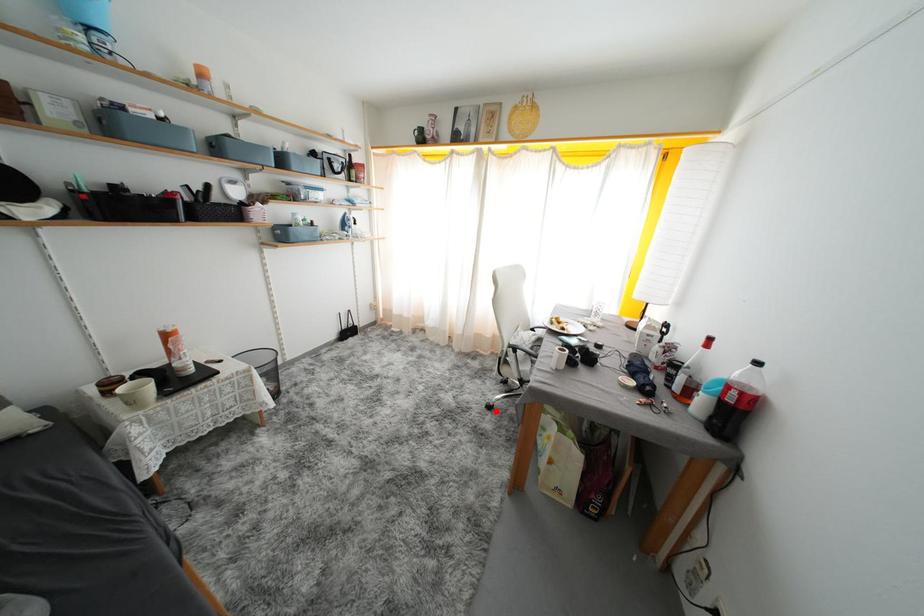
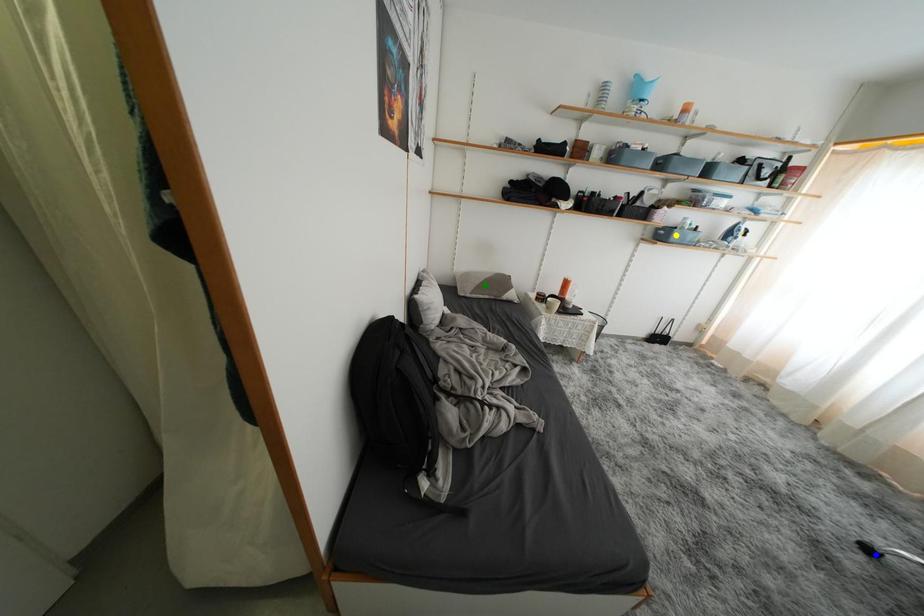
Question: I am providing you with two images of the same scene from different viewpoints. A red point is marked on the first image. You are given multiple points on the second image. Which spot in image 2 lines up with the point in image 1?

Choices:
 (A) blue point
 (B) green point
 (C) yellow point

Answer: (A)